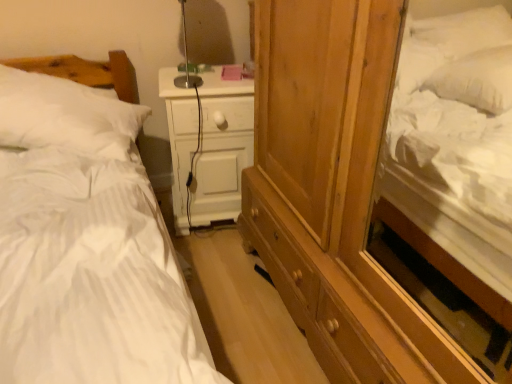
Identify the location of free space above white matte nightstand at center (from a real-world perspective). (210, 75).